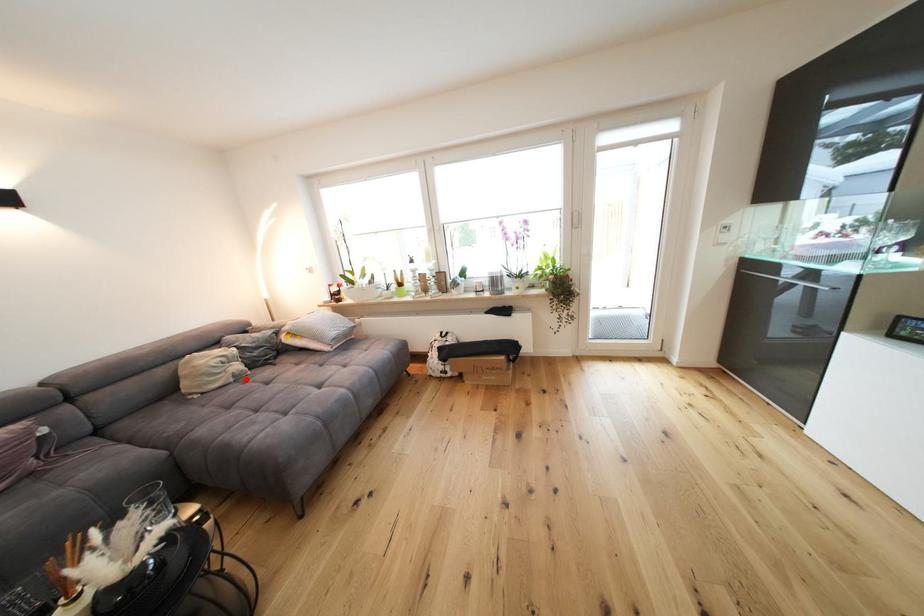
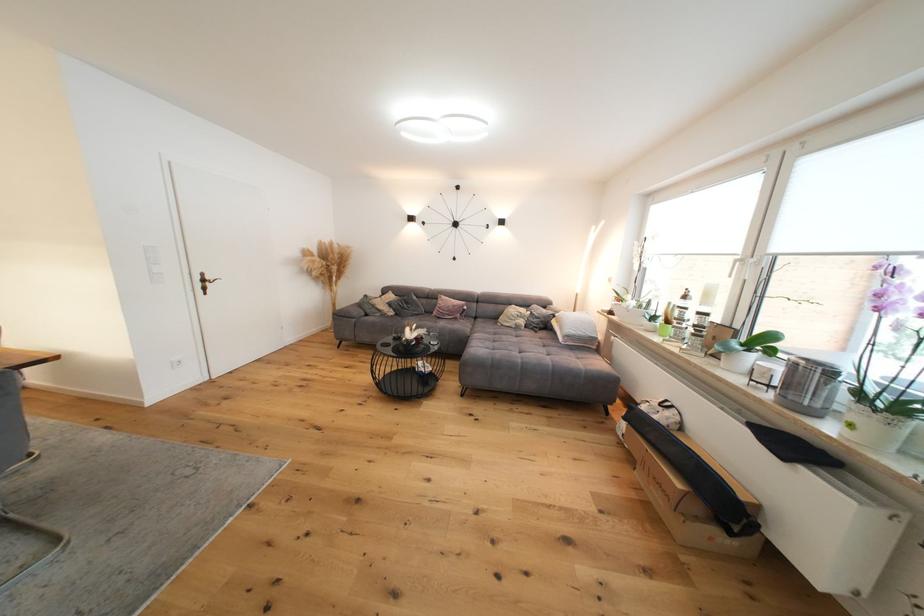
Question: I am providing you with two images of the same scene from different viewpoints. A red point is shown in image1. For the corresponding object point in image2, is it positioned nearer or farther from the camera?

Choices:
 (A) Nearer
 (B) Farther

Answer: (B)